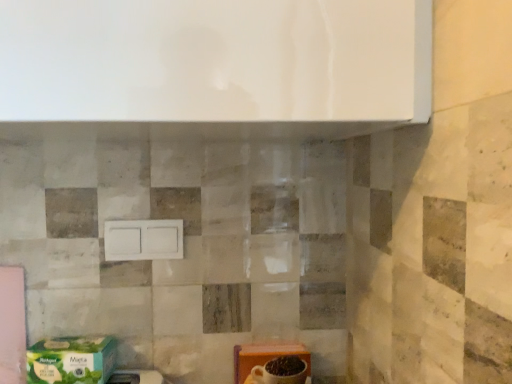
Question: Is green matte cardboard box at lower left, placed as the 2th cardboard box when sorted from right to left, in front of white matte switch at center?

Choices:
 (A) yes
 (B) no

Answer: (A)

Question: Is green matte cardboard box at lower left, which appears as the first cardboard box when viewed from the left, bigger than white matte switch at center?

Choices:
 (A) no
 (B) yes

Answer: (B)

Question: Can you confirm if green matte cardboard box at lower left, which appears as the first cardboard box when viewed from the left, is taller than white matte switch at center?

Choices:
 (A) no
 (B) yes

Answer: (A)

Question: Can you confirm if green matte cardboard box at lower left, placed as the 2th cardboard box when sorted from right to left, is wider than white matte switch at center?

Choices:
 (A) yes
 (B) no

Answer: (A)

Question: Is green matte cardboard box at lower left, placed as the 2th cardboard box when sorted from right to left, oriented away from white matte switch at center?

Choices:
 (A) yes
 (B) no

Answer: (B)

Question: Considering the positions of orange cardboard box at lower right, which appears as the first cardboard box when viewed from the right, and white matte switch at center in the image, is orange cardboard box at lower right, which appears as the first cardboard box when viewed from the right, wider or thinner than white matte switch at center?

Choices:
 (A) thin
 (B) wide

Answer: (B)

Question: Is orange cardboard box at lower right, which is the 2th cardboard box in left-to-right order, taller or shorter than white matte switch at center?

Choices:
 (A) short
 (B) tall

Answer: (B)

Question: From the image's perspective, is orange cardboard box at lower right, which appears as the first cardboard box when viewed from the right, located above or below white matte switch at center?

Choices:
 (A) below
 (B) above

Answer: (A)

Question: Visually, is orange cardboard box at lower right, which is the 2th cardboard box in left-to-right order, positioned to the left or to the right of white matte switch at center?

Choices:
 (A) left
 (B) right

Answer: (B)

Question: In terms of width, does green matte cardboard box at lower left, placed as the 2th cardboard box when sorted from right to left, look wider or thinner when compared to orange cardboard box at lower right, which appears as the first cardboard box when viewed from the right?

Choices:
 (A) thin
 (B) wide

Answer: (B)

Question: Is green matte cardboard box at lower left, placed as the 2th cardboard box when sorted from right to left, taller or shorter than orange cardboard box at lower right, which is the 2th cardboard box in left-to-right order?

Choices:
 (A) short
 (B) tall

Answer: (A)

Question: Is green matte cardboard box at lower left, which appears as the first cardboard box when viewed from the left, situated inside orange cardboard box at lower right, which is the 2th cardboard box in left-to-right order, or outside?

Choices:
 (A) outside
 (B) inside

Answer: (A)

Question: From the image's perspective, is green matte cardboard box at lower left, placed as the 2th cardboard box when sorted from right to left, positioned above or below orange cardboard box at lower right, which appears as the first cardboard box when viewed from the right?

Choices:
 (A) below
 (B) above

Answer: (B)

Question: Looking at their shapes, would you say green matte cardboard box at lower left, placed as the 2th cardboard box when sorted from right to left, is wider or thinner than white matte switch at center?

Choices:
 (A) thin
 (B) wide

Answer: (B)

Question: Is green matte cardboard box at lower left, placed as the 2th cardboard box when sorted from right to left, bigger or smaller than white matte switch at center?

Choices:
 (A) big
 (B) small

Answer: (A)